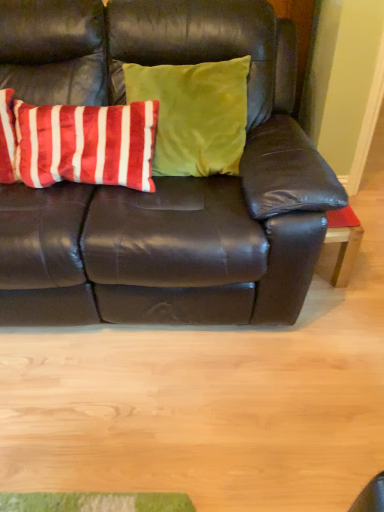
This screenshot has height=512, width=384. Describe the element at coordinates (162, 178) in the screenshot. I see `matte black couch at center` at that location.

Identify the location of matte black couch at center. This screenshot has height=512, width=384. (162, 178).

Locate an element on the screen. The image size is (384, 512). matte black couch at center is located at coordinates (162, 178).